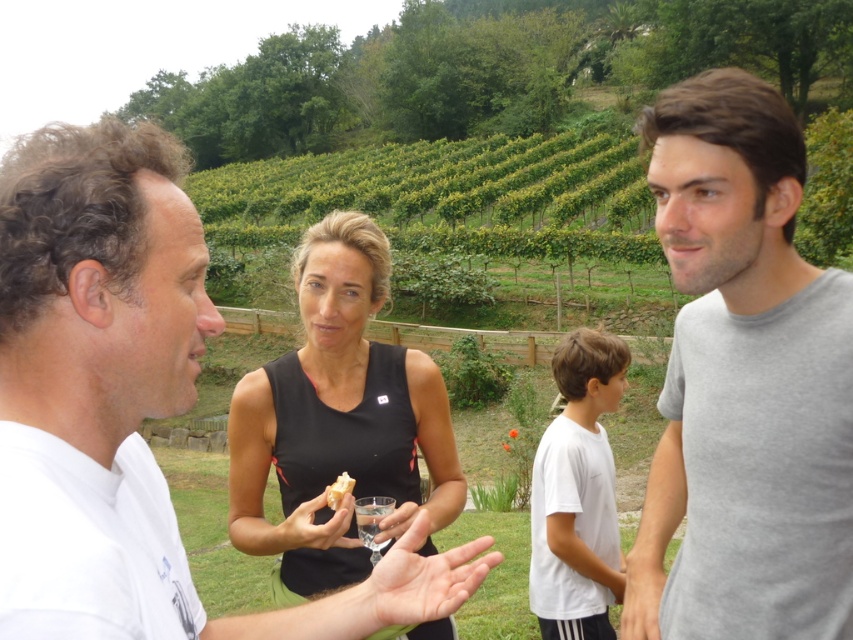
Which is behind, point (393, 579) or point (340, 481)?

The point (340, 481) is more distant.

Does white cotton shirt at upper left appear over white crumbly bread at center?

Actually, white cotton shirt at upper left is below white crumbly bread at center.

Describe the element at coordinates (129, 404) in the screenshot. I see `white cotton shirt at upper left` at that location.

The image size is (853, 640). I want to click on white cotton shirt at upper left, so click(129, 404).

Between white cotton shirt at center and white crumbly bread at center, which one has less height?

With less height is white crumbly bread at center.

Does white cotton shirt at center have a larger size compared to white crumbly bread at center?

Yes.

This screenshot has height=640, width=853. Identify the location of white cotton shirt at center. (577, 493).

This screenshot has width=853, height=640. I want to click on white cotton shirt at center, so click(577, 493).

Is white cotton shirt at upper left bigger than black matte tank top at center?

Correct, white cotton shirt at upper left is larger in size than black matte tank top at center.

Find the location of a particular element. This screenshot has width=853, height=640. white cotton shirt at upper left is located at coordinates (129, 404).

Locate an element on the screen. The image size is (853, 640). white cotton shirt at upper left is located at coordinates (129, 404).